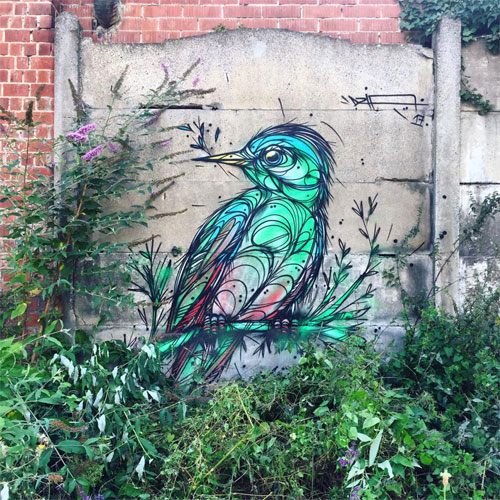
Locate an element on the screen. concrete wall is located at coordinates click(x=400, y=70).